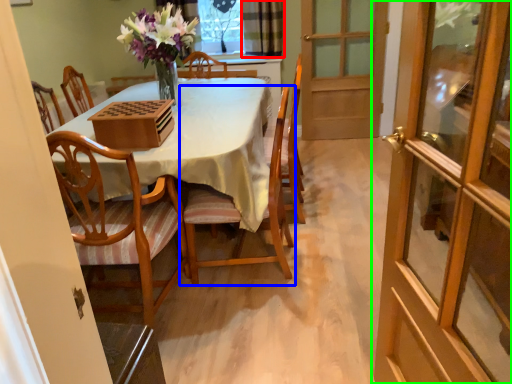
Question: Which object is the farthest from curtain (highlighted by a red box)? Choose among these: chair (highlighted by a blue box) or door (highlighted by a green box).

Choices:
 (A) chair
 (B) door

Answer: (B)